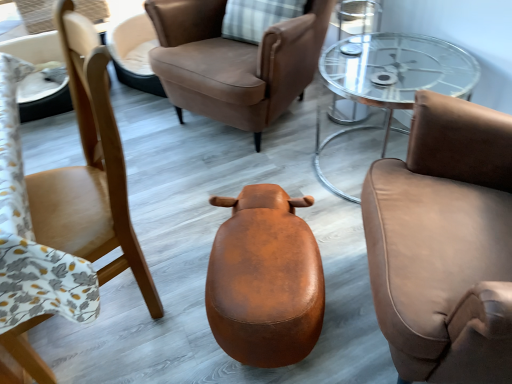
Question: In terms of size, does brown leather stool at center appear bigger or smaller than brown leather chair at right, which is the 1th chair from right to left?

Choices:
 (A) small
 (B) big

Answer: (A)

Question: Looking at their shapes, would you say brown leather stool at center is wider or thinner than brown leather chair at right, which is the 1th chair from right to left?

Choices:
 (A) thin
 (B) wide

Answer: (B)

Question: Considering the real-world distances, which object is closest to the matte brown chair at left, which is the 1th chair from left to right?

Choices:
 (A) brown leather chair at right, which is the 1th chair from right to left
 (B) brown leather stool at center
 (C) brown leather chair at center, which is the 2th chair from right to left
 (D) clear glass coffee table at center

Answer: (B)

Question: Which object is the farthest from the clear glass coffee table at center?

Choices:
 (A) brown leather stool at center
 (B) brown leather chair at center, the second chair viewed from the left
 (C) matte brown chair at left, which is the 3th chair in right-to-left order
 (D) brown leather chair at right, which is the 1th chair from right to left

Answer: (C)